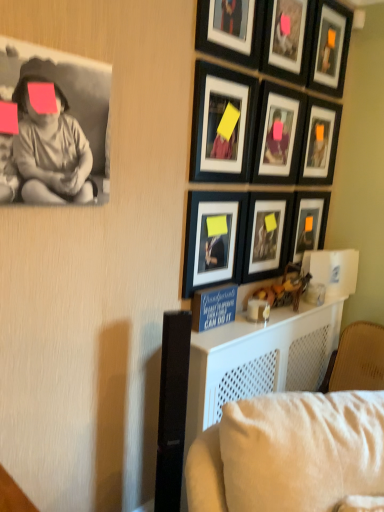
Question: From a real-world perspective, is matte black picture frame at center, acting as the 8th picture frame starting from the top, on top of matte black picture frame at upper center, positioned as the 5th picture frame in top-to-bottom order?

Choices:
 (A) yes
 (B) no

Answer: (B)

Question: Considering the relative sizes of matte black picture frame at center, positioned as the second picture frame in bottom-to-top order, and matte black picture frame at upper center, marked as the 5th picture frame in a bottom-to-top arrangement, in the image provided, is matte black picture frame at center, positioned as the second picture frame in bottom-to-top order, wider than matte black picture frame at upper center, marked as the 5th picture frame in a bottom-to-top arrangement,?

Choices:
 (A) no
 (B) yes

Answer: (A)

Question: Can you confirm if matte black picture frame at center, acting as the 8th picture frame starting from the top, is positioned to the right of matte black picture frame at upper center, positioned as the 5th picture frame in top-to-bottom order?

Choices:
 (A) no
 (B) yes

Answer: (A)

Question: Does matte black picture frame at center, acting as the 8th picture frame starting from the top, appear on the left side of matte black picture frame at upper center, marked as the 5th picture frame in a bottom-to-top arrangement?

Choices:
 (A) yes
 (B) no

Answer: (A)

Question: Is matte black picture frame at upper center, marked as the 5th picture frame in a bottom-to-top arrangement, a part of matte black picture frame at center, acting as the 8th picture frame starting from the top?

Choices:
 (A) yes
 (B) no

Answer: (B)

Question: Is matte black picture frame at upper center, positioned as the 5th picture frame in top-to-bottom order, to the left or to the right of matte black picture frame at upper right, the 4th picture frame positioned from the top, in the image?

Choices:
 (A) left
 (B) right

Answer: (A)

Question: From a real-world perspective, relative to matte black picture frame at upper right, which is the 6th picture frame in bottom-to-top order, is matte black picture frame at upper center, positioned as the 5th picture frame in top-to-bottom order, vertically above or below?

Choices:
 (A) above
 (B) below

Answer: (A)

Question: Does point (279, 164) appear closer or farther from the camera than point (329, 101)?

Choices:
 (A) closer
 (B) farther

Answer: (A)

Question: Relative to matte black picture frame at upper right, the 4th picture frame positioned from the top, is matte black picture frame at upper center, positioned as the 5th picture frame in top-to-bottom order, in front or behind?

Choices:
 (A) front
 (B) behind

Answer: (A)

Question: From the image's perspective, is black matte picture frame at upper center, which ranks as the 7th picture frame in bottom-to-top order, above or below matte black picture frame at upper center, positioned as the 5th picture frame in top-to-bottom order?

Choices:
 (A) below
 (B) above

Answer: (B)

Question: Considering the positions of black matte picture frame at upper center, acting as the third picture frame starting from the top, and matte black picture frame at upper center, marked as the 5th picture frame in a bottom-to-top arrangement, in the image, is black matte picture frame at upper center, acting as the third picture frame starting from the top, bigger or smaller than matte black picture frame at upper center, marked as the 5th picture frame in a bottom-to-top arrangement,?

Choices:
 (A) big
 (B) small

Answer: (B)

Question: Considering the relative positions of black matte picture frame at upper center, acting as the third picture frame starting from the top, and matte black picture frame at upper center, marked as the 5th picture frame in a bottom-to-top arrangement, in the image provided, is black matte picture frame at upper center, acting as the third picture frame starting from the top, to the left or to the right of matte black picture frame at upper center, marked as the 5th picture frame in a bottom-to-top arrangement,?

Choices:
 (A) left
 (B) right

Answer: (A)

Question: Considering the positions of point (259, 15) and point (284, 116), is point (259, 15) closer or farther from the camera than point (284, 116)?

Choices:
 (A) farther
 (B) closer

Answer: (B)

Question: From the image's perspective, is matte black picture frame at upper right, which is the 6th picture frame in bottom-to-top order, above or below matte black photo of child at upper left?

Choices:
 (A) above
 (B) below

Answer: (A)

Question: Which is correct: matte black picture frame at upper right, the 4th picture frame positioned from the top, is inside matte black photo of child at upper left, or outside of it?

Choices:
 (A) inside
 (B) outside

Answer: (B)